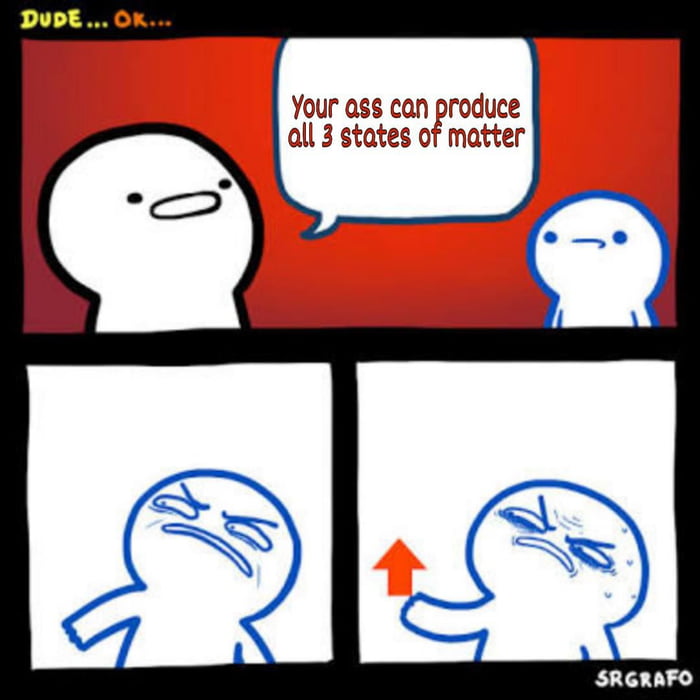
Where is `black lines around pictures`? black lines around pictures is located at coordinates (407, 24), (330, 342), (346, 420), (295, 679), (18, 526), (690, 454).